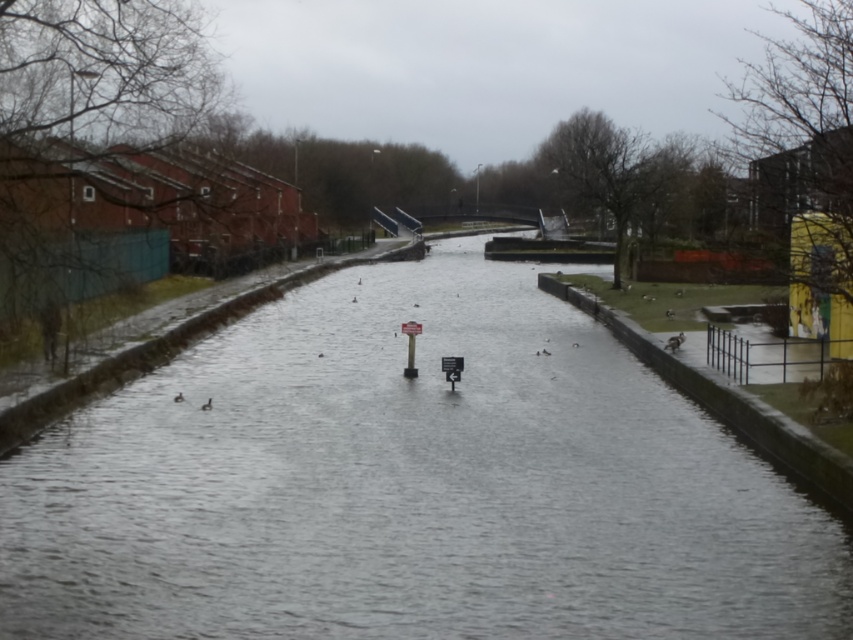
Can you confirm if metallic street sign at center is shorter than metallic gray signpost at center?

No.

Can you confirm if metallic street sign at center is bigger than metallic gray signpost at center?

Yes, metallic street sign at center is bigger than metallic gray signpost at center.

Where is `metallic street sign at center`? This screenshot has width=853, height=640. metallic street sign at center is located at coordinates coord(410,346).

Identify the location of metallic street sign at center. (410, 346).

Consider the image. Between smooth concrete canal at center and metallic street sign at center, which one has less height?

metallic street sign at center

Who is more forward, (15, 477) or (413, 346)?

Point (15, 477)

Between point (228, 611) and point (413, 326), which one is positioned in front?

Point (228, 611) is more forward.

Find the location of a particular element. smooth concrete canal at center is located at coordinates (410, 484).

Between smooth concrete canal at center and metallic gray signpost at center, which one appears on the left side from the viewer's perspective?

Positioned to the left is smooth concrete canal at center.

Who is higher up, smooth concrete canal at center or metallic gray signpost at center?

Positioned higher is metallic gray signpost at center.

Locate an element on the screen. smooth concrete canal at center is located at coordinates (410, 484).